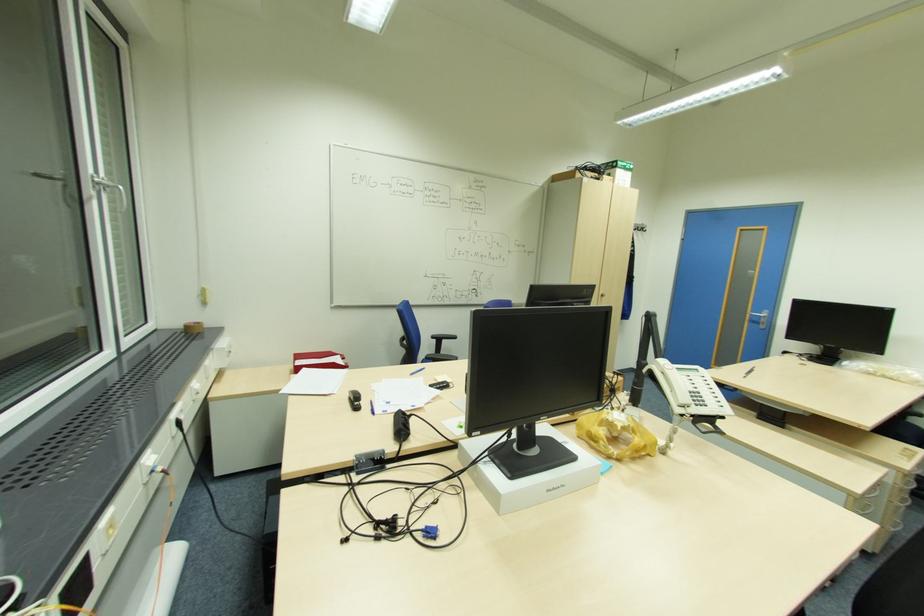
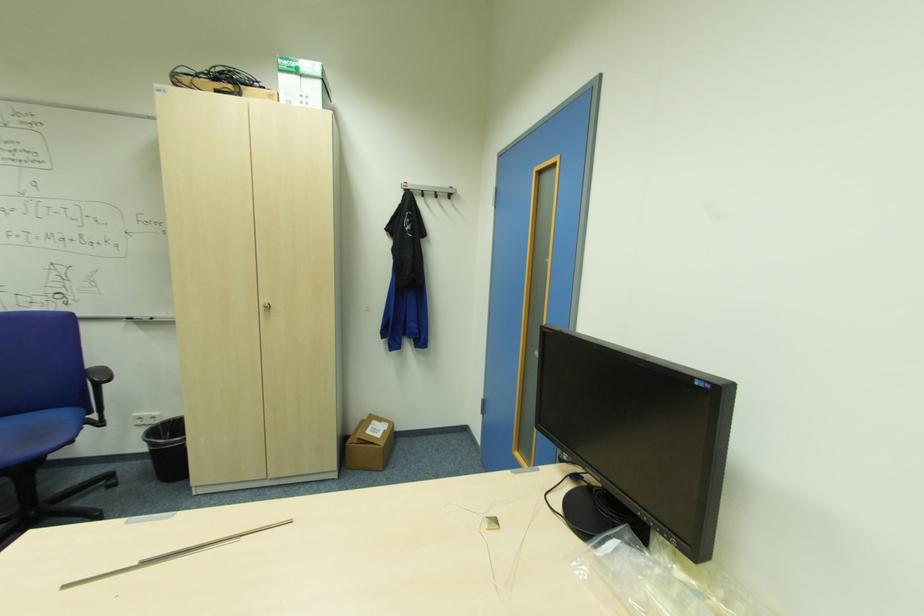
Find the pixel in the second image that matches point (623, 166) in the first image.

(287, 69)